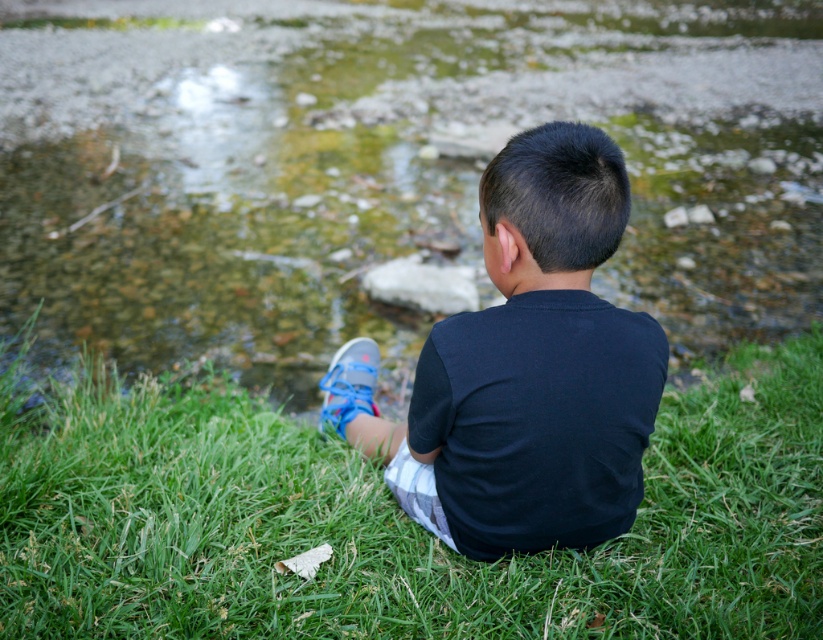
You are a photographer trying to capture the boy in the scene. You want to ensure the green grass at lower center and the black cotton shirt at center are both visible in the frame. Based on their positions, which object should you focus on first to ensure both are in the shot?

The black cotton shirt at center is on the left side of the green grass at lower center, so focusing on the black cotton shirt at center first would ensure both objects are included in the frame.

In the scene shown: You are a drone operator trying to capture an aerial shot of the green grass at lower center. According to the coordinates provided, where should you direct your camera to focus?

The green grass at lower center is located at coordinates point (x=389, y=518), so you should direct your camera to focus there.

You are a photographer setting up a shot of the boy in the scene. You need to ensure that both the black cotton shirt at center and the blue mesh shoe at lower center are visible in the frame. Which object should you focus on first to make sure both are in focus?

The black cotton shirt at center is positioned over the blue mesh shoe at lower center, so focusing on the black cotton shirt at center first will ensure both are in focus since it is closer to the camera.